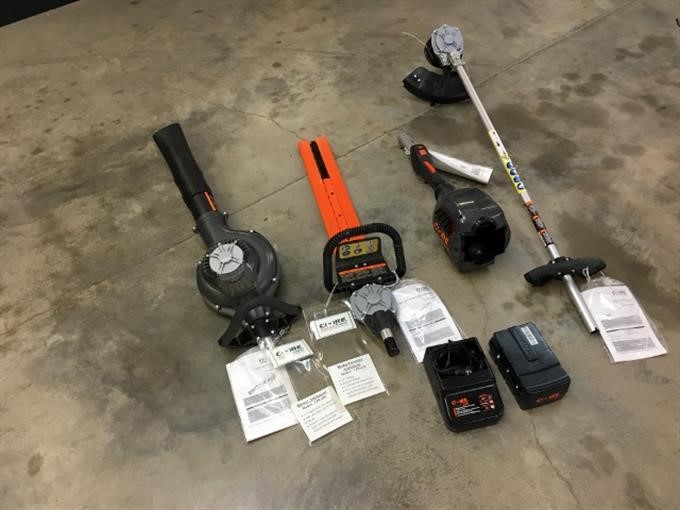
Where is `floor`? The image size is (680, 510). floor is located at coordinates (71, 145).